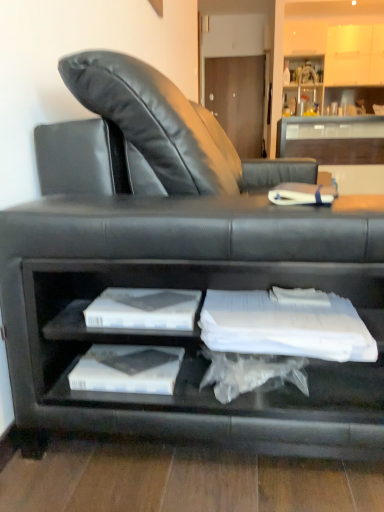
Question: From a real-world perspective, is white paper at center positioned above or below matte white cabinet at upper right?

Choices:
 (A) below
 (B) above

Answer: (A)

Question: Choose the correct answer: Is white paper at center inside matte white cabinet at upper right or outside it?

Choices:
 (A) inside
 (B) outside

Answer: (B)

Question: Which object is positioned farthest from the clear glass table at upper center?

Choices:
 (A) white paper at center
 (B) matte white cabinet at upper right
 (C) white paper at lower center

Answer: (C)

Question: Which is farther from the matte white cabinet at upper right?

Choices:
 (A) clear glass table at upper center
 (B) white paper at center
 (C) white paper at lower center

Answer: (C)